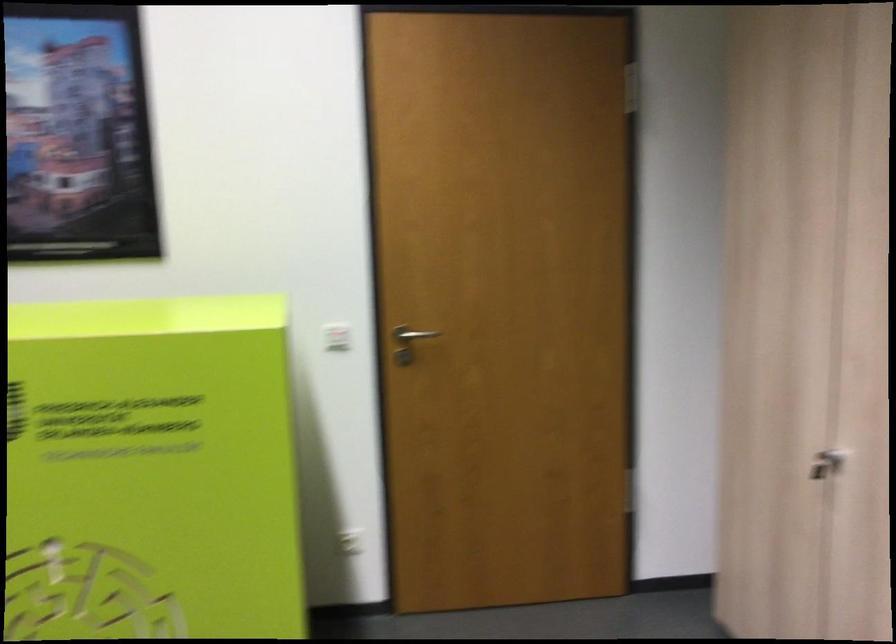
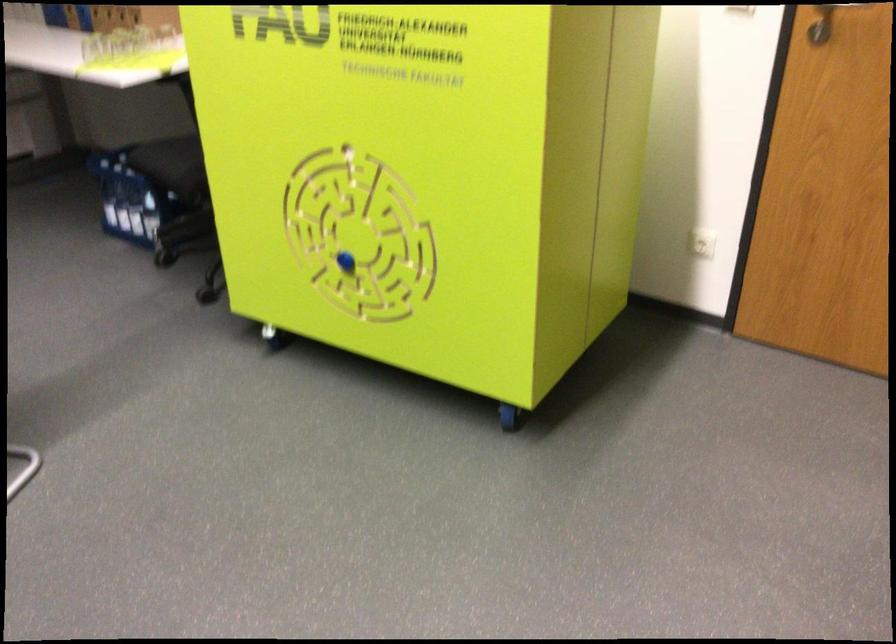
Where in the second image is the point corresponding to [403,341] from the first image?

(821, 24)